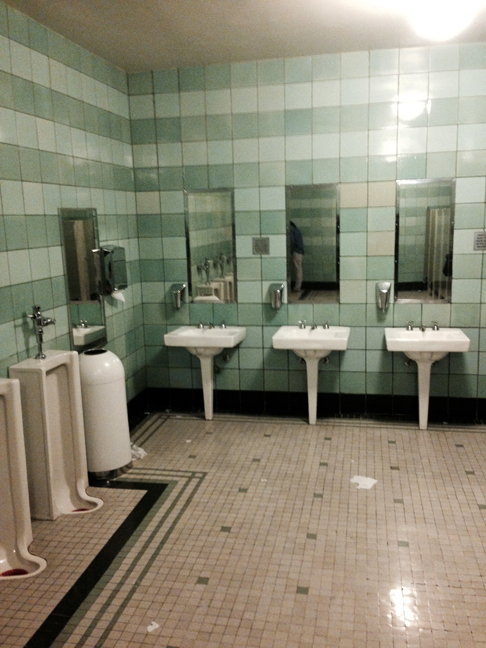
Where is `ceiling`? The image size is (486, 648). ceiling is located at coordinates (195, 25).